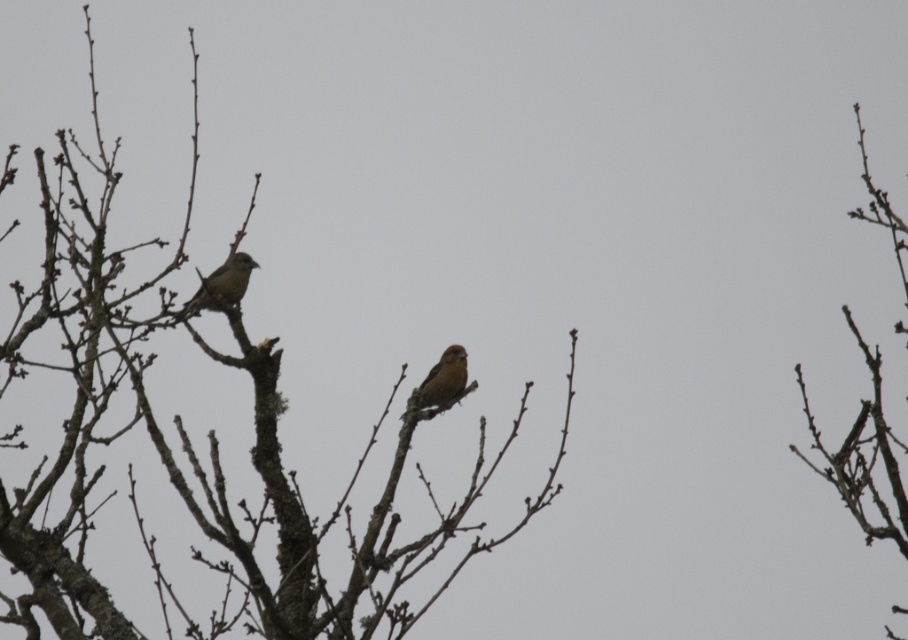
Between brown textured tree at center and brown matte bird at left, which one appears on the left side from the viewer's perspective?

Positioned to the left is brown textured tree at center.

Who is shorter, brown textured tree at center or brown matte bird at left?

brown matte bird at left is shorter.

Does point (277, 372) lie in front of point (243, 291)?

Yes, point (277, 372) is closer to viewer.

Find the location of a particular element. brown textured tree at center is located at coordinates (193, 449).

Does brown matte bird at left have a greater width compared to brown matte bird at center?

Indeed, brown matte bird at left has a greater width compared to brown matte bird at center.

Measure the distance between point (252,260) and camera.

A distance of 6.58 meters exists between point (252,260) and camera.

Which is behind, point (215, 275) or point (430, 410)?

Positioned behind is point (430, 410).

The height and width of the screenshot is (640, 908). Find the location of `brown matte bird at left`. brown matte bird at left is located at coordinates (221, 285).

Does point (890, 218) lie in front of point (240, 259)?

Yes.

You are a GUI agent. You are given a task and a screenshot of the screen. Output one action in this format:
    pyautogui.click(x=<x>, y=<y>)
    Task: Click on the bark textured branch at right
    
    Given the screenshot: What is the action you would take?
    pyautogui.click(x=864, y=456)